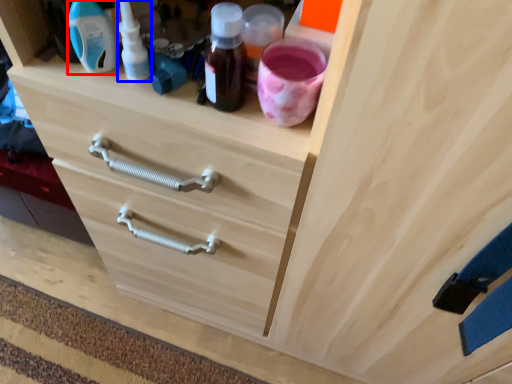
Question: Which object is further to the camera taking this photo, bottle (highlighted by a red box) or bottle (highlighted by a blue box)?

Choices:
 (A) bottle
 (B) bottle

Answer: (B)